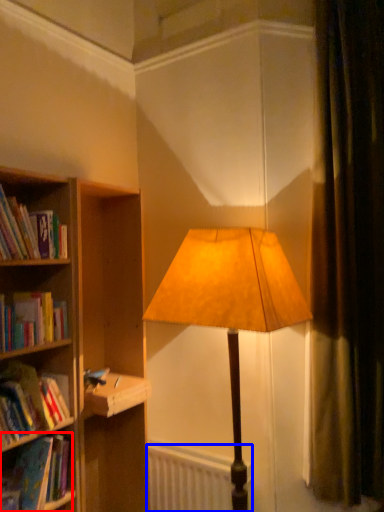
Question: Which point is closer to the camera, book (highlighted by a red box) or radiator (highlighted by a blue box)?

Choices:
 (A) book
 (B) radiator

Answer: (A)